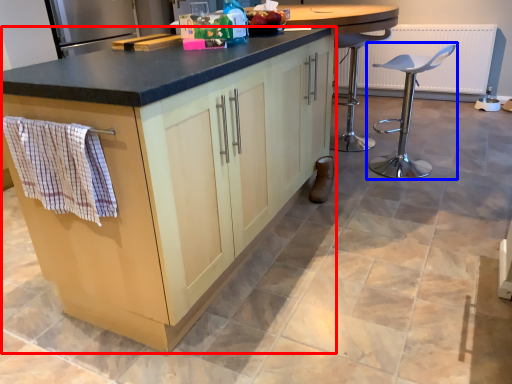
Question: Which object appears closest to the camera in this image, cabinetry (highlighted by a red box) or chair (highlighted by a blue box)?

Choices:
 (A) cabinetry
 (B) chair

Answer: (A)